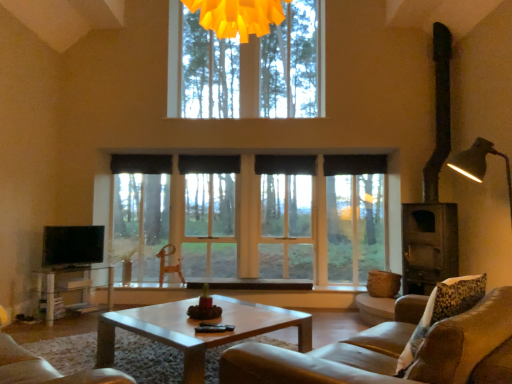
Question: Is black fabric curtain at center, the 4th curtain in the left-to-right sequence, at the back of black fabric curtain at center, marked as the second curtain in a left-to-right arrangement?

Choices:
 (A) no
 (B) yes

Answer: (A)

Question: From a real-world perspective, does black fabric curtain at center, marked as the second curtain in a left-to-right arrangement, sit lower than black fabric curtain at center, which is the 1th curtain from right to left?

Choices:
 (A) yes
 (B) no

Answer: (B)

Question: Considering the relative sizes of black fabric curtain at center, arranged as the 3th curtain when viewed from the right, and black fabric curtain at center, the 4th curtain in the left-to-right sequence, in the image provided, is black fabric curtain at center, arranged as the 3th curtain when viewed from the right, thinner than black fabric curtain at center, the 4th curtain in the left-to-right sequence,?

Choices:
 (A) no
 (B) yes

Answer: (A)

Question: Is black fabric curtain at center, arranged as the 3th curtain when viewed from the right, in front of black fabric curtain at center, the 4th curtain in the left-to-right sequence?

Choices:
 (A) yes
 (B) no

Answer: (B)

Question: Can you confirm if black fabric curtain at center, marked as the second curtain in a left-to-right arrangement, is shorter than black fabric curtain at center, which is the 1th curtain from right to left?

Choices:
 (A) yes
 (B) no

Answer: (A)

Question: From a real-world perspective, is black fabric curtain at center, marked as the second curtain in a left-to-right arrangement, physically above black fabric curtain at center, which is the 1th curtain from right to left?

Choices:
 (A) no
 (B) yes

Answer: (B)

Question: Is black fabric curtain at center, marked as the second curtain in a left-to-right arrangement, a part of light brown wooden coffee table at center?

Choices:
 (A) yes
 (B) no

Answer: (B)

Question: Is light brown wooden coffee table at center smaller than black fabric curtain at center, arranged as the 3th curtain when viewed from the right?

Choices:
 (A) yes
 (B) no

Answer: (B)

Question: From the image's perspective, is light brown wooden coffee table at center on black fabric curtain at center, arranged as the 3th curtain when viewed from the right?

Choices:
 (A) no
 (B) yes

Answer: (A)

Question: Can you confirm if light brown wooden coffee table at center is positioned to the left of black fabric curtain at center, marked as the second curtain in a left-to-right arrangement?

Choices:
 (A) no
 (B) yes

Answer: (B)

Question: Is light brown wooden coffee table at center not close to black fabric curtain at center, arranged as the 3th curtain when viewed from the right?

Choices:
 (A) yes
 (B) no

Answer: (A)

Question: Can you confirm if light brown wooden coffee table at center is wider than black fabric curtain at center, arranged as the 3th curtain when viewed from the right?

Choices:
 (A) yes
 (B) no

Answer: (A)

Question: Is flat screen tv at left bigger than black fabric curtain at center, which is the 1th curtain from right to left?

Choices:
 (A) no
 (B) yes

Answer: (B)